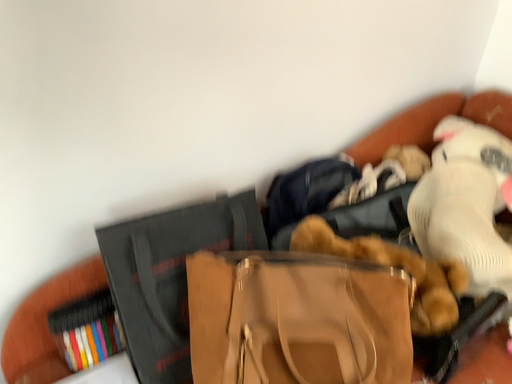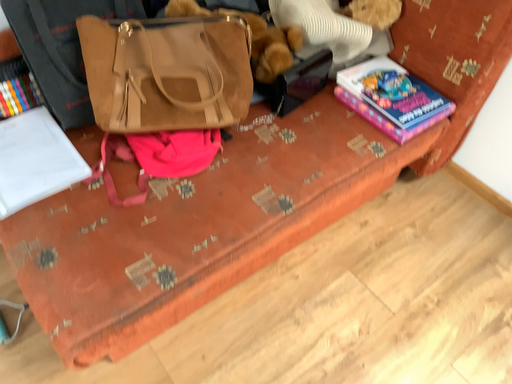
Question: How did the camera likely rotate when shooting the video?

Choices:
 (A) rotated left
 (B) rotated right

Answer: (B)